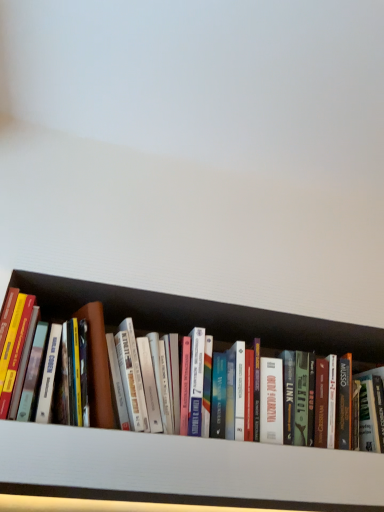
At what (x,y) coordinates should I click in order to perform the action: click on white wood cabinet at lower center. Please return your answer as a coordinate pair (x, y). The image size is (384, 512). Looking at the image, I should click on (185, 470).

This screenshot has height=512, width=384. What do you see at coordinates (185, 470) in the screenshot? I see `white wood cabinet at lower center` at bounding box center [185, 470].

What do you see at coordinates (203, 318) in the screenshot? I see `hardcover books at center` at bounding box center [203, 318].

This screenshot has width=384, height=512. What are the coordinates of `hardcover books at center` in the screenshot? It's located at (203, 318).

Locate an element on the screen. white wood cabinet at lower center is located at coordinates [x=185, y=470].

In the image, is white wood cabinet at lower center on the left side or the right side of hardcover books at center?

white wood cabinet at lower center is to the right of hardcover books at center.

In the image, is white wood cabinet at lower center positioned in front of or behind hardcover books at center?

white wood cabinet at lower center is positioned closer to the viewer than hardcover books at center.

Considering the positions of point (216, 499) and point (146, 326), is point (216, 499) closer or farther from the camera than point (146, 326)?

Point (216, 499) is positioned closer to the camera compared to point (146, 326).

From the image's perspective, would you say white wood cabinet at lower center is shown under hardcover books at center?

Yes, from the image's perspective, white wood cabinet at lower center is below hardcover books at center.

From a real-world perspective, is white wood cabinet at lower center located beneath hardcover books at center?

Correct, in the physical world, white wood cabinet at lower center is lower than hardcover books at center.

Considering the sizes of objects white wood cabinet at lower center and hardcover books at center in the image provided, who is wider, white wood cabinet at lower center or hardcover books at center?

With larger width is white wood cabinet at lower center.

Consider the image. Between white wood cabinet at lower center and hardcover books at center, which one has more height?

Standing taller between the two is hardcover books at center.

Looking at the image, does white wood cabinet at lower center seem bigger or smaller compared to hardcover books at center?

In the image, white wood cabinet at lower center appears to be smaller than hardcover books at center.

Is white wood cabinet at lower center inside or outside of hardcover books at center?

white wood cabinet at lower center cannot be found inside hardcover books at center.

Is white wood cabinet at lower center in contact with hardcover books at center?

There is a gap between white wood cabinet at lower center and hardcover books at center.

Is white wood cabinet at lower center facing away from hardcover books at center?

white wood cabinet at lower center is not turned away from hardcover books at center.

How different are the orientations of white wood cabinet at lower center and hardcover books at center in degrees?

There is a 3.51e-05-degree angle between the facing directions of white wood cabinet at lower center and hardcover books at center.

I want to click on book behind the white wood cabinet at lower center, so click(203, 318).

Is hardcover books at center to the left or to the right of white wood cabinet at lower center in the image?

hardcover books at center is to the left of white wood cabinet at lower center.

Considering the positions of objects hardcover books at center and white wood cabinet at lower center in the image provided, who is behind, hardcover books at center or white wood cabinet at lower center?

Positioned behind is hardcover books at center.

Which point is more forward, [166,315] or [153,452]?

The point [153,452] is closer.

From the image's perspective, is hardcover books at center positioned above or below white wood cabinet at lower center?

Clearly, from the image's perspective, hardcover books at center is above white wood cabinet at lower center.

From a real-world perspective, which object stands above the other?

hardcover books at center, from a real-world perspective.

Looking at this image, is hardcover books at center thinner than white wood cabinet at lower center?

Yes, hardcover books at center is thinner than white wood cabinet at lower center.

Which of these two, hardcover books at center or white wood cabinet at lower center, stands shorter?

white wood cabinet at lower center.

Which of these two, hardcover books at center or white wood cabinet at lower center, is smaller?

Smaller between the two is white wood cabinet at lower center.

From the picture: Is hardcover books at center not within white wood cabinet at lower center?

Yes, hardcover books at center is not within white wood cabinet at lower center.

From the picture: Is hardcover books at center placed right next to white wood cabinet at lower center?

No, hardcover books at center is not with white wood cabinet at lower center.

Is hardcover books at center turned away from white wood cabinet at lower center?

That's not correct — hardcover books at center is not looking away from white wood cabinet at lower center.

What's the angular difference between hardcover books at center and white wood cabinet at lower center's facing directions?

3.51e-05 degrees.

Measure the distance between hardcover books at center and white wood cabinet at lower center.

hardcover books at center and white wood cabinet at lower center are 12.05 inches apart from each other.

I want to click on cabinet lying in front of the hardcover books at center, so click(185, 470).

Identify the location of book on the left of white wood cabinet at lower center. This screenshot has width=384, height=512. (203, 318).

In order to click on book behind the white wood cabinet at lower center in this screenshot , I will do `click(203, 318)`.